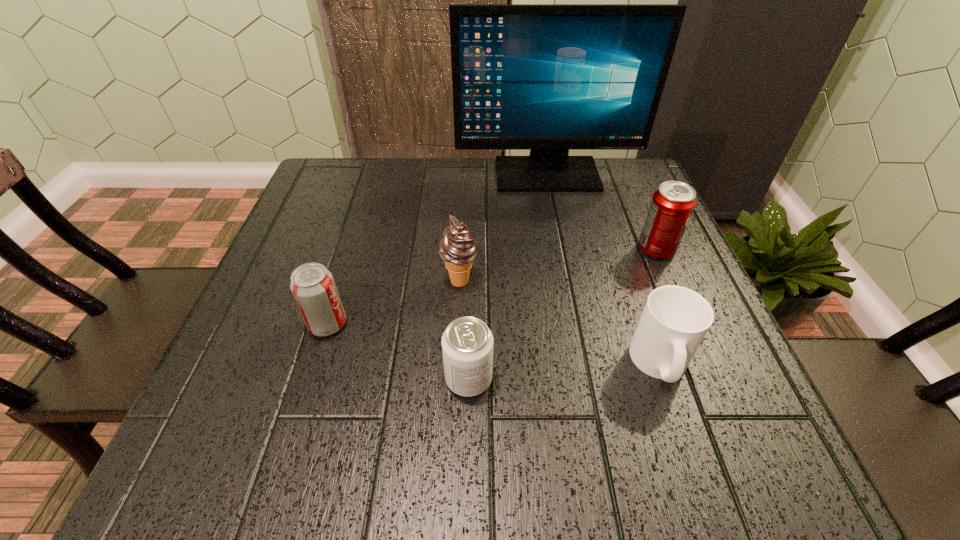
Find the location of a particular element. The image size is (960, 540). object that is at the far right corner is located at coordinates (548, 78).

In order to click on vacant space at the far edge in this screenshot , I will do `click(385, 200)`.

You are a GUI agent. You are given a task and a screenshot of the screen. Output one action in this format:
    pyautogui.click(x=<x>, y=<y>)
    Task: Click on the free region at the near edge of the desktop
    The height and width of the screenshot is (540, 960).
    Given the screenshot: What is the action you would take?
    pyautogui.click(x=348, y=474)

I want to click on free location at the left edge, so click(283, 277).

Identify the location of vacant region at the far left corner. Image resolution: width=960 pixels, height=540 pixels. (376, 171).

Where is `vacant space at the near left corner`? The image size is (960, 540). vacant space at the near left corner is located at coordinates (193, 481).

I want to click on blank space at the far right corner, so click(x=626, y=199).

Locate an element on the screen. This screenshot has height=540, width=960. vacant area that lies between the leftmost soda can and the monitor is located at coordinates (438, 249).

Identify the location of free space between the leftmost soda can and the rightmost soda can. (492, 287).

Locate an element on the screen. The image size is (960, 540). free space between the fourth nearest object and the farthest object is located at coordinates (503, 228).